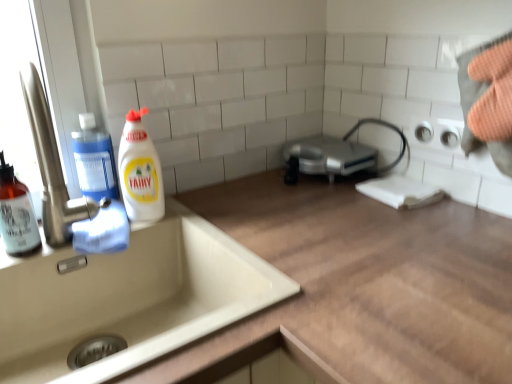
Question: From a real-world perspective, is translucent amber bottle at left, which is the third cleaning product in right-to-left order, physically located above or below white glossy bottle at left, the third cleaning product viewed from the left?

Choices:
 (A) below
 (B) above

Answer: (A)

Question: Is translucent amber bottle at left, the 1th cleaning product when ordered from left to right, taller or shorter than white glossy bottle at left, which appears as the first cleaning product when viewed from the right?

Choices:
 (A) tall
 (B) short

Answer: (B)

Question: Based on their relative distances, which object is nearer to the white glossy bottle at left, which appears as the first cleaning product when viewed from the right?

Choices:
 (A) silver metallic toaster at center
 (B) transparent plastic soap dispenser at left, the 2th cleaning product when ordered from left to right
 (C) translucent amber bottle at left, the 1th cleaning product when ordered from left to right
 (D) beige ceramic sink at lower left

Answer: (B)

Question: Which object is positioned farthest from the beige ceramic sink at lower left?

Choices:
 (A) transparent plastic soap dispenser at left, which is the second cleaning product from right to left
 (B) silver metallic toaster at center
 (C) translucent amber bottle at left, the 1th cleaning product when ordered from left to right
 (D) white glossy bottle at left, the third cleaning product viewed from the left

Answer: (B)